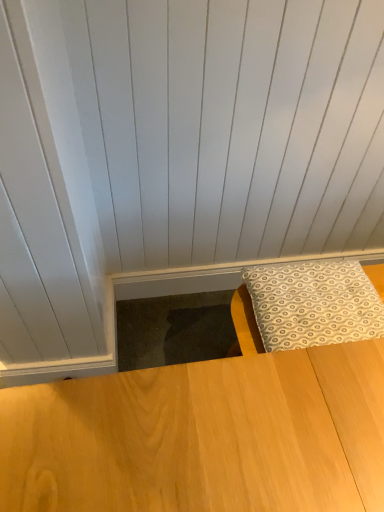
Find the location of `free point above patterned fabric pillow at lower right (from a real-world perspective)`. free point above patterned fabric pillow at lower right (from a real-world perspective) is located at coordinates (304, 291).